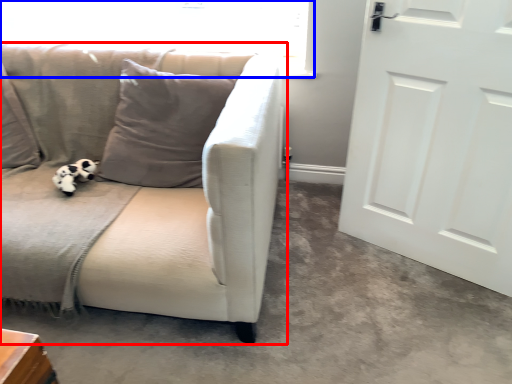
Question: Which object is closer to the camera taking this photo, studio couch (highlighted by a red box) or window screen (highlighted by a blue box)?

Choices:
 (A) studio couch
 (B) window screen

Answer: (A)